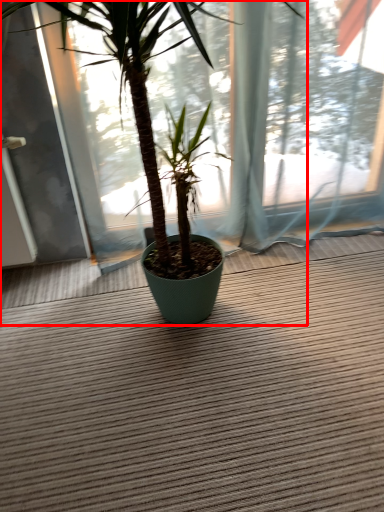
Question: From the image's perspective, considering the relative positions of houseplant (annotated by the red box) and doormat in the image provided, where is houseplant (annotated by the red box) located with respect to the staircase?

Choices:
 (A) below
 (B) above

Answer: (B)